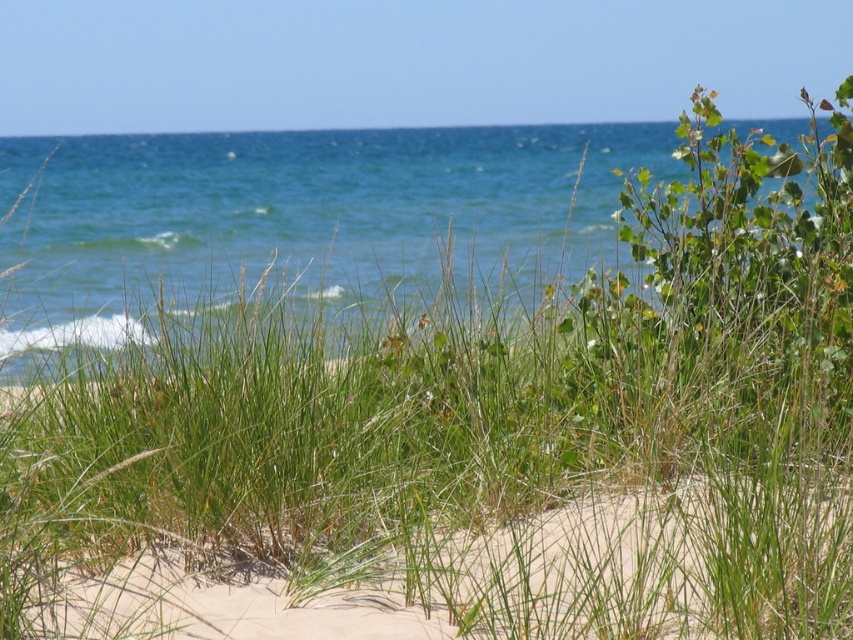
You are standing on the beach and want to walk from the light beige sand at lower center to the blue water at upper center. Which direction should you head towards?

You should head towards the left because the blue water at upper center is to the left of the light beige sand at lower center.

You are planning to build a small sandcastle on the beach. Given the sizes of the blue water at upper center and the light beige sand at lower center, which area would provide more space for constructing your sandcastle?

The light beige sand at lower center is smaller in size than the blue water at upper center, so the blue water at upper center would provide more space for constructing the sandcastle.